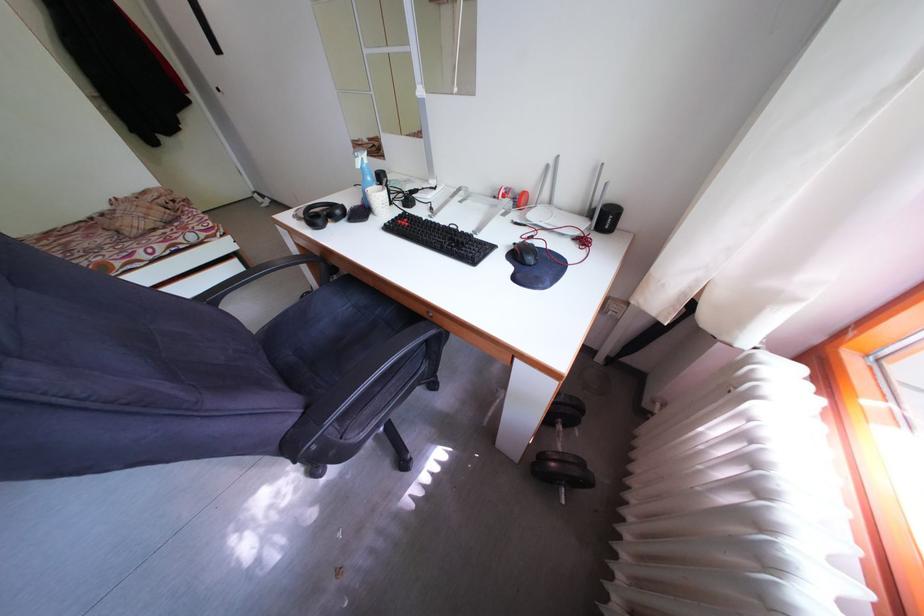
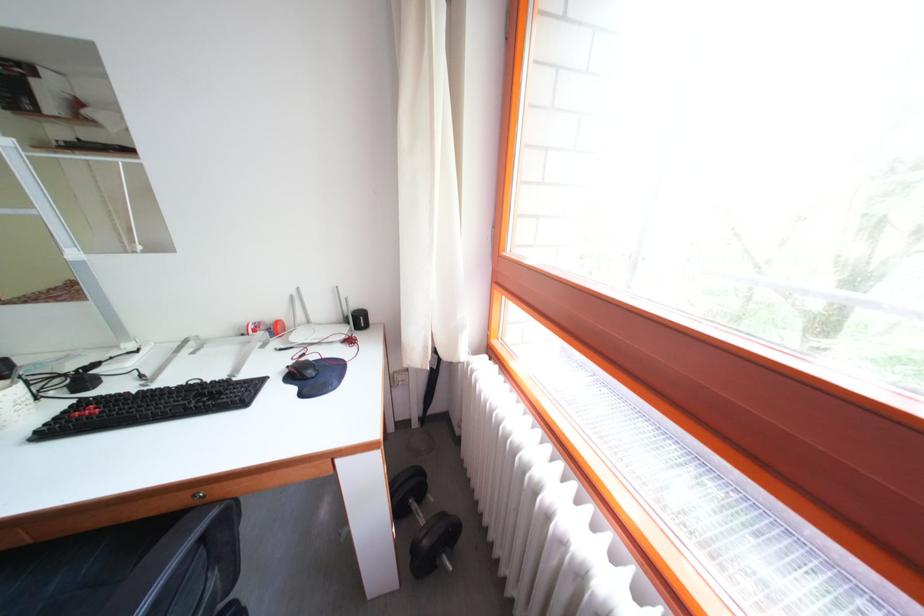
Question: The first image is from the beginning of the video and the second image is from the end. How did the camera likely rotate when shooting the video?

Choices:
 (A) Left
 (B) Right
 (C) Up
 (D) Down

Answer: (B)